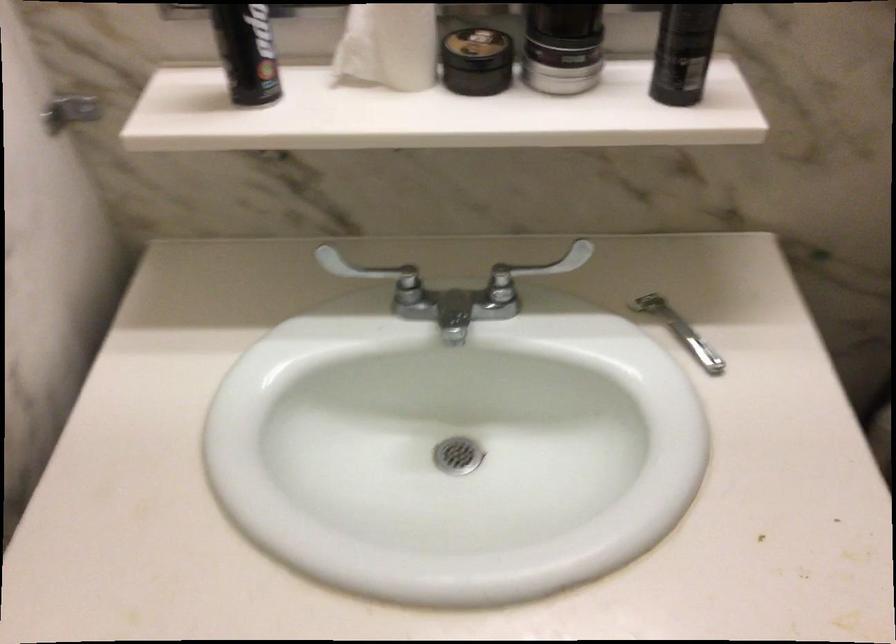
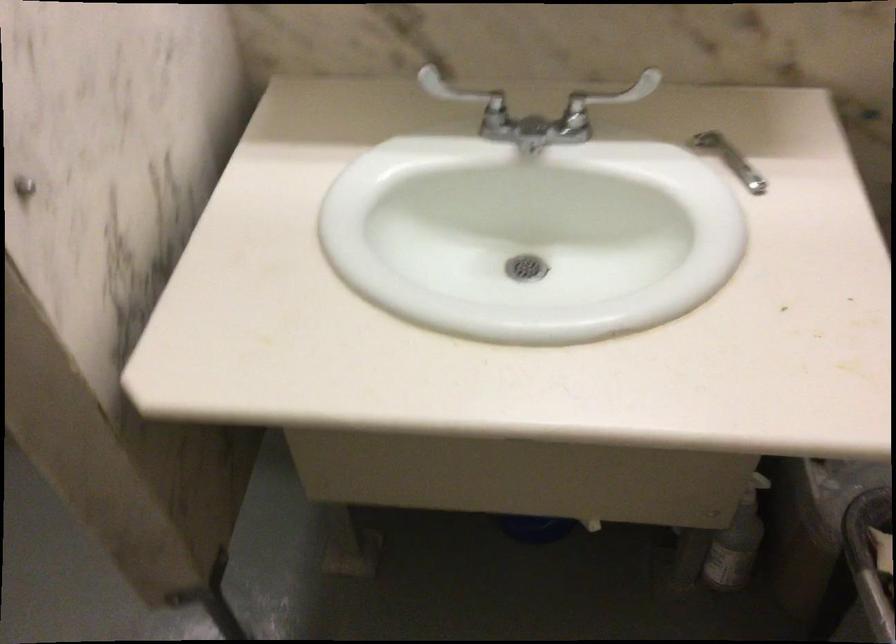
Where in the second image is the point corresponding to [686,333] from the first image?

(729, 158)